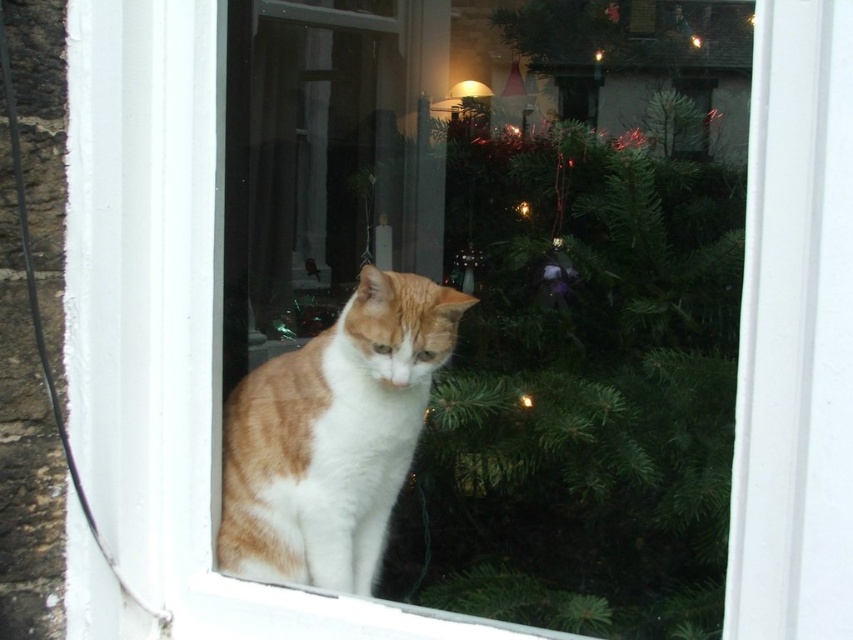
You are standing in front of the window and notice two points marked on the reflection of the Christmas tree. The first point is at coordinates point (670,278) and the second at point (325,336). Which point is closer to you?

Point (670,278) is further to the viewer than point (325,336), so the point closer to you is point (325,336).